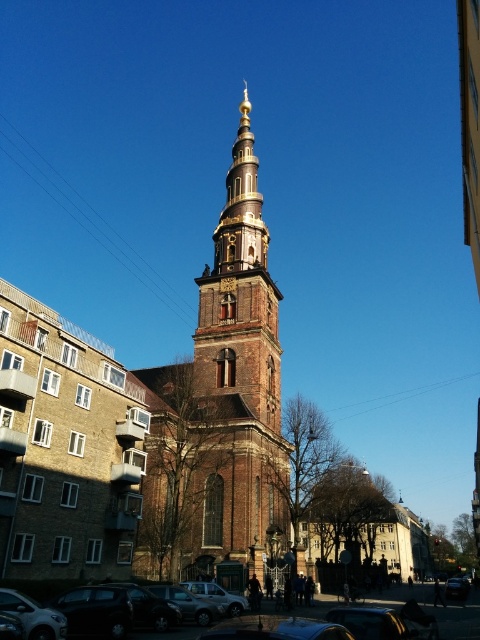
Can you confirm if brown brick tower at center is thinner than shiny black car at lower right?

No.

Which of these two, brown brick tower at center or shiny black car at lower right, stands taller?

With more height is brown brick tower at center.

Between point (220, 541) and point (445, 586), which one is positioned in front?

Point (220, 541) is more forward.

This screenshot has width=480, height=640. What are the coordinates of `brown brick tower at center` in the screenshot? It's located at (220, 406).

Is matte black car at lower left positioned before shiny black car at lower right?

Yes, it is in front of shiny black car at lower right.

Does matte black car at lower left have a lesser height compared to shiny black car at lower right?

Correct, matte black car at lower left is not as tall as shiny black car at lower right.

Between point (216, 605) and point (444, 592), which one is positioned behind?

The point (444, 592) is behind.

Identify the location of matte black car at lower left. Image resolution: width=480 pixels, height=640 pixels. (189, 604).

Who is taller, matte black car at lower left or silver metallic car at center?

Standing taller between the two is matte black car at lower left.

Between point (199, 620) and point (237, 614), which one is positioned in front?

Point (199, 620)

Image resolution: width=480 pixels, height=640 pixels. I want to click on matte black car at lower left, so click(x=189, y=604).